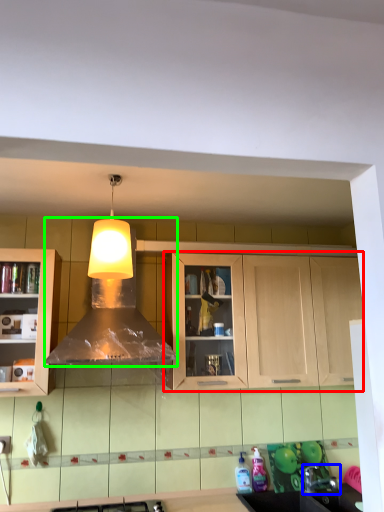
Question: Which object is positioned farthest from cabinetry (highlighted by a red box)? Select from faucet (highlighted by a blue box) and hood (highlighted by a green box).

Choices:
 (A) faucet
 (B) hood

Answer: (A)